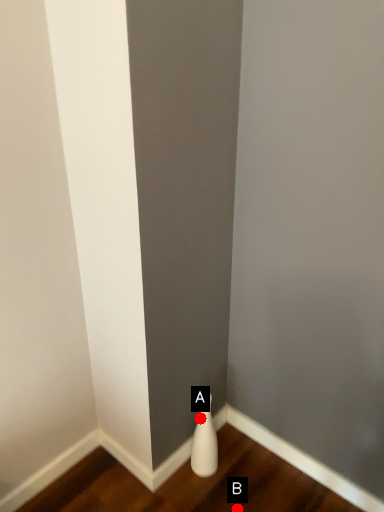
Question: Two points are circled on the image, labeled by A and B beside each circle. Which of the following is the closest to the observer?

Choices:
 (A) A is closer
 (B) B is closer

Answer: (B)